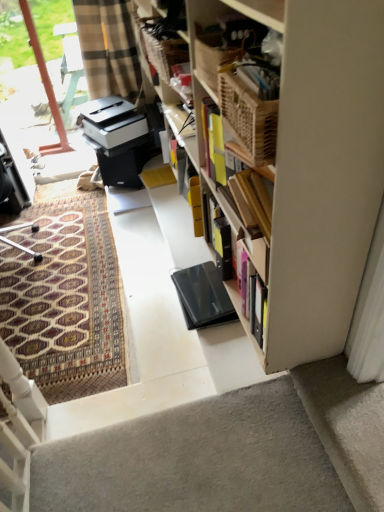
What do you see at coordinates (65, 298) in the screenshot? I see `patterned carpet at left` at bounding box center [65, 298].

You are a GUI agent. You are given a task and a screenshot of the screen. Output one action in this format:
    pyautogui.click(x=<x>, y=<y>)
    Task: Click on the transparent glass door at upper left
    The image size is (384, 512).
    Given the screenshot: What is the action you would take?
    pyautogui.click(x=44, y=80)

The image size is (384, 512). Describe the element at coordinates (17, 170) in the screenshot. I see `metallic silver desk at left` at that location.

Where is `wooden picnic basket at upper center`? This screenshot has height=512, width=384. wooden picnic basket at upper center is located at coordinates (213, 56).

Describe the element at coordinates (213, 56) in the screenshot. This screenshot has width=384, height=512. I see `wooden picnic basket at upper center` at that location.

Image resolution: width=384 pixels, height=512 pixels. What do you see at coordinates (112, 121) in the screenshot?
I see `white plastic printer at center` at bounding box center [112, 121].

Where is `patterned carpet at left`? The image size is (384, 512). patterned carpet at left is located at coordinates (65, 298).

Which is closer to the camera, [350,490] or [115,101]?

The point [350,490] is closer.

Could you tell me if gray carpet at bottom right is facing white plastic printer at center?

No.

Are gray carpet at bottom right and white plastic printer at center far apart?

That's right, there is a large distance between gray carpet at bottom right and white plastic printer at center.

From the image's perspective, is gray carpet at bottom right over white plastic printer at center?

Incorrect, from the image's perspective, gray carpet at bottom right is lower than white plastic printer at center.

Is point (35, 322) farther from camera compared to point (317, 417)?

That is True.

Looking at their sizes, would you say patterned carpet at left is wider or thinner than gray carpet at bottom right?

Considering their sizes, patterned carpet at left looks broader than gray carpet at bottom right.

Is patterned carpet at left positioned with its back to gray carpet at bottom right?

No, patterned carpet at left's orientation is not away from gray carpet at bottom right.

Looking at this image, is patterned carpet at left at the right side of gray carpet at bottom right?

In fact, patterned carpet at left is to the left of gray carpet at bottom right.

Which is correct: transparent glass door at upper left is inside gray carpet at bottom right, or outside of it?

transparent glass door at upper left is outside gray carpet at bottom right.

Who is taller, transparent glass door at upper left or gray carpet at bottom right?

With more height is transparent glass door at upper left.

The width and height of the screenshot is (384, 512). What are the coordinates of `concrete below the transparent glass door at upper left (from the image's perspective)` in the screenshot? It's located at (347, 426).

Is transparent glass door at upper left far away from gray carpet at bottom right?

Yes, transparent glass door at upper left is far from gray carpet at bottom right.

Considering the sizes of objects white plastic printer at center and gray carpet at bottom right in the image provided, who is taller, white plastic printer at center or gray carpet at bottom right?

With more height is white plastic printer at center.

Is white plastic printer at center positioned with its back to gray carpet at bottom right?

No.

Between white plastic printer at center and gray carpet at bottom right, which one has larger width?

Wider between the two is white plastic printer at center.

Is metallic silver desk at left at the right side of gray carpet at bottom right?

No.

From the image's perspective, is metallic silver desk at left located above or below gray carpet at bottom right?

Clearly, from the image's perspective, metallic silver desk at left is above gray carpet at bottom right.

Is metallic silver desk at left aimed at gray carpet at bottom right?

No.

Is the position of patterned carpet at left less distant than that of black matte laptop at center?

No, patterned carpet at left is further to the viewer.

Can you tell me how much patterned carpet at left and black matte laptop at center differ in facing direction?

The angular difference between patterned carpet at left and black matte laptop at center is 175 degrees.

From a real-world perspective, is patterned carpet at left over black matte laptop at center?

No, from a real-world perspective, patterned carpet at left is not over black matte laptop at center

Who is smaller, white plastic printer at center or patterned carpet at left?

white plastic printer at center.

In the image, is white plastic printer at center positioned in front of or behind patterned carpet at left?

white plastic printer at center is behind patterned carpet at left.

Does point (132, 131) appear closer or farther from the camera than point (64, 365)?

Point (132, 131) appears to be farther away from the viewer than point (64, 365).

Considering the relative sizes of white plastic printer at center and patterned carpet at left in the image provided, is white plastic printer at center shorter than patterned carpet at left?

Incorrect, the height of white plastic printer at center does not fall short of that of patterned carpet at left.

I want to click on concrete on the right of white plastic printer at center, so click(x=347, y=426).

What are the coordinates of `concrete below the patterned carpet at left (from the image's perspective)` in the screenshot? It's located at (347, 426).

Which object lies further to the anchor point white plastic printer at center, gray carpet at bottom right or transparent glass door at upper left?

gray carpet at bottom right lies further to white plastic printer at center than the other object.

From the image, which object appears to be nearer to patterned carpet at left, black matte laptop at center or white plastic printer at center?

black matte laptop at center.

When comparing their distances from patterned carpet at left, does black matte laptop at center or transparent glass door at upper left seem further?

transparent glass door at upper left lies further to patterned carpet at left than the other object.

Which object lies further to the anchor point white plastic printer at center, patterned carpet at left or wooden picnic basket at upper center?

wooden picnic basket at upper center is further to white plastic printer at center.

Looking at the image, which one is located further to patterned carpet at left, white plastic printer at center or metallic silver desk at left?

white plastic printer at center is further to patterned carpet at left.

Estimate the real-world distances between objects in this image. Which object is further from wooden picnic basket at upper center, transparent glass door at upper left or metallic silver desk at left?

transparent glass door at upper left is positioned further to the anchor wooden picnic basket at upper center.

Considering their positions, is patterned carpet at left positioned further to black matte laptop at center than metallic silver desk at left?

Based on the image, metallic silver desk at left appears to be further to black matte laptop at center.

Which object lies nearer to the anchor point transparent glass door at upper left, patterned carpet at left or white plastic printer at center?

white plastic printer at center is positioned closer to the anchor transparent glass door at upper left.

At what (x,y) coordinates should I click in order to perform the action: click on glass door situated between metallic silver desk at left and gray carpet at bottom right from left to right. Please return your answer as a coordinate pair (x, y). The width and height of the screenshot is (384, 512). Looking at the image, I should click on (44, 80).

Where is `doormat situated between metallic silver desk at left and gray carpet at bottom right from left to right`? The width and height of the screenshot is (384, 512). doormat situated between metallic silver desk at left and gray carpet at bottom right from left to right is located at coordinates (65, 298).

In order to click on desk between wooden picnic basket at upper center and transparent glass door at upper left in the front-back direction in this screenshot , I will do `click(17, 170)`.

Locate an element on the screen. The height and width of the screenshot is (512, 384). equipment between transparent glass door at upper left and gray carpet at bottom right vertically is located at coordinates pos(203,296).